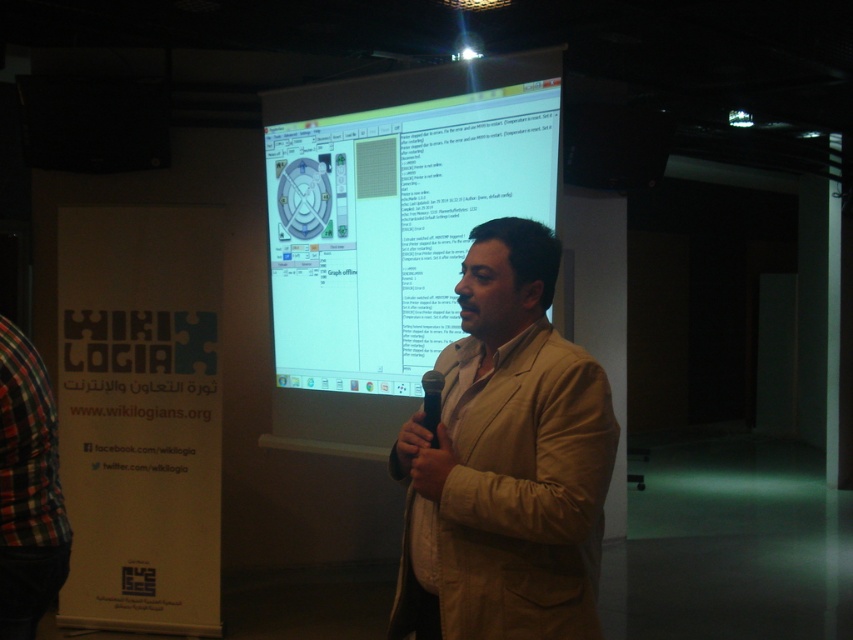
Is beige fabric coat at center shorter than plaid fabric shirt at left?

Incorrect, beige fabric coat at center's height does not fall short of plaid fabric shirt at left's.

Is beige fabric coat at center closer to camera compared to plaid fabric shirt at left?

Yes, it is.

This screenshot has width=853, height=640. In order to click on beige fabric coat at center in this screenshot , I will do `click(506, 460)`.

Consider the image. Between white glossy projection screen at center and plaid fabric shirt at left, which one has more height?

Standing taller between the two is white glossy projection screen at center.

Does white glossy projection screen at center appear under plaid fabric shirt at left?

No.

Is point (345, 150) behind point (18, 612)?

Yes, point (345, 150) is farther from viewer.

Locate an element on the screen. Image resolution: width=853 pixels, height=640 pixels. white glossy projection screen at center is located at coordinates click(x=389, y=230).

In the scene shown: Which of these two, beige fabric coat at center or black plastic microphone at center, stands shorter?

With less height is black plastic microphone at center.

Describe the element at coordinates (506, 460) in the screenshot. I see `beige fabric coat at center` at that location.

This screenshot has width=853, height=640. Describe the element at coordinates (506, 460) in the screenshot. I see `beige fabric coat at center` at that location.

Locate an element on the screen. beige fabric coat at center is located at coordinates (506, 460).